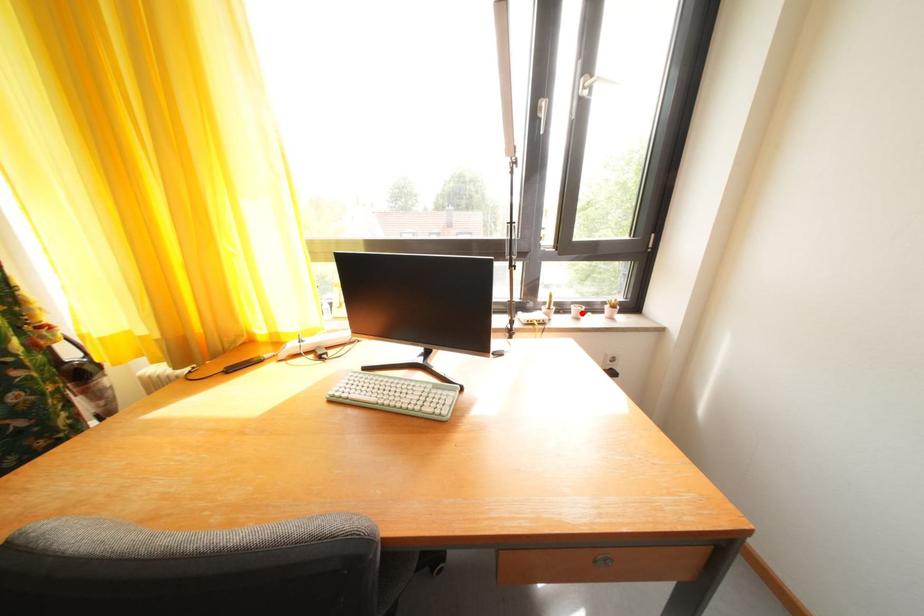
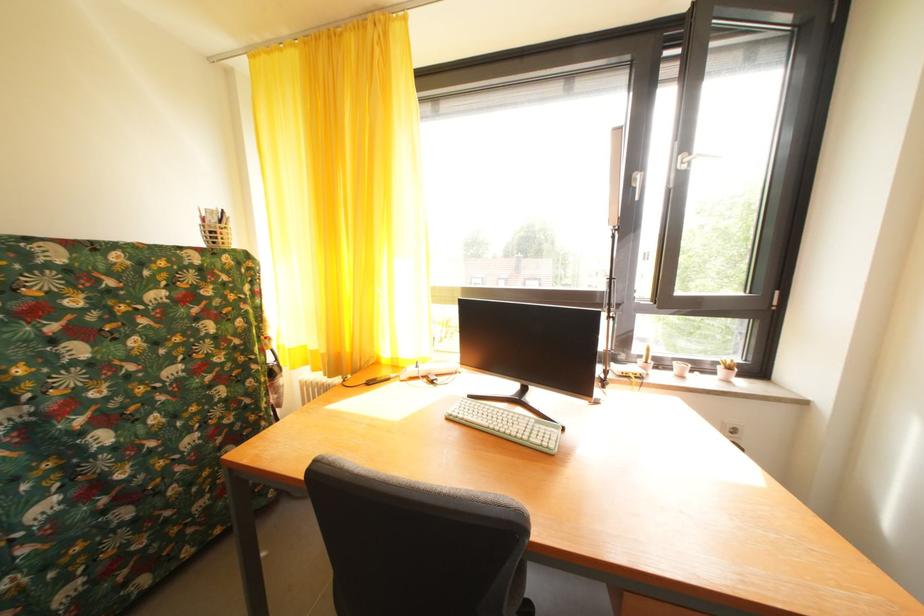
In the second image, find the point that corresponds to the highlighted location in the first image.

(685, 370)